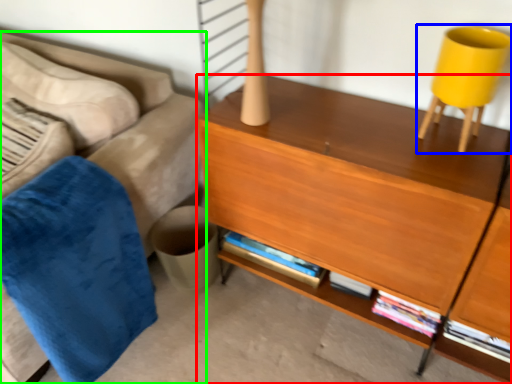
Question: Which object is the closest to the desk (highlighted by a red box)? Choose among these: swivel chair (highlighted by a blue box) or studio couch (highlighted by a green box).

Choices:
 (A) swivel chair
 (B) studio couch

Answer: (A)